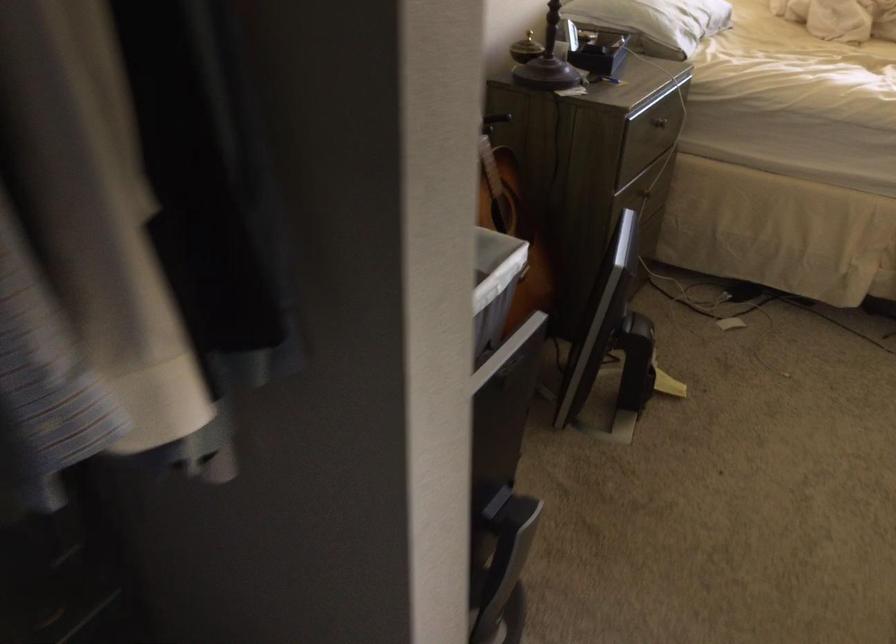
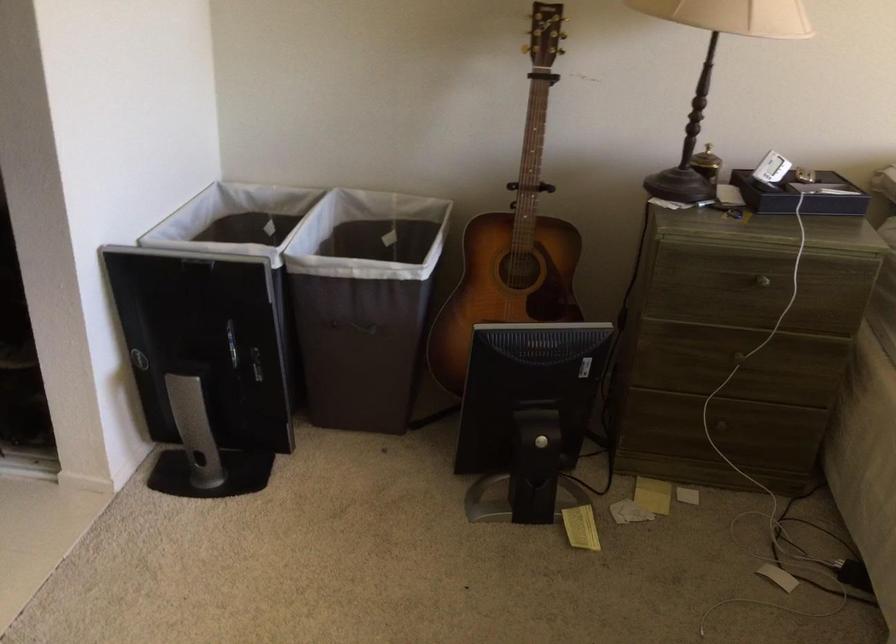
Find the pixel in the second image that matches the point at 642,257 in the first image.

(718, 427)